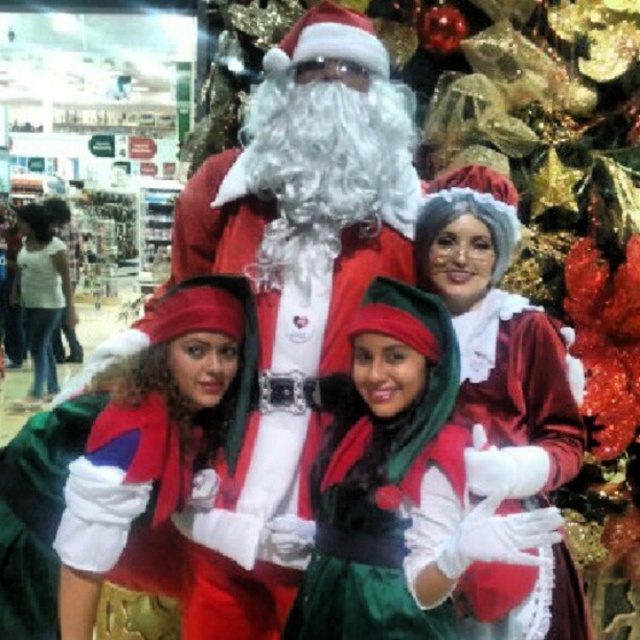
Question: Can you confirm if velvet red santa at center is smaller than velvet red dress at center?

Choices:
 (A) yes
 (B) no

Answer: (B)

Question: Can you confirm if velvet red santa at center is positioned below velvet red dress at center?

Choices:
 (A) yes
 (B) no

Answer: (B)

Question: Which of the following is the farthest from the observer?

Choices:
 (A) velvet red dress at center
 (B) velvet green dress at center

Answer: (A)

Question: Estimate the real-world distances between objects in this image. Which object is farther from the velvet red santa at center?

Choices:
 (A) velvet green dress at center
 (B) velvet red dress at center

Answer: (B)

Question: Can you confirm if velvet green dress at center is smaller than velvet red dress at center?

Choices:
 (A) yes
 (B) no

Answer: (B)

Question: Which object is farther from the camera taking this photo?

Choices:
 (A) velvet red santa at center
 (B) velvet green dress at center

Answer: (A)